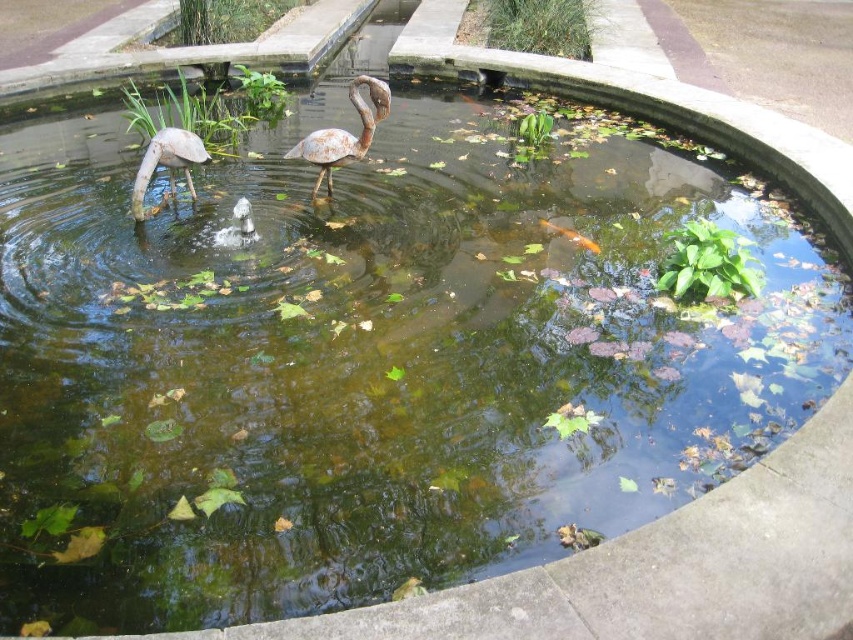
Is point (317, 173) closer to camera compared to point (184, 154)?

No, it is not.

Between rusty metal flamingo at center and matte white flamingo at left, which one is positioned lower?

matte white flamingo at left

Image resolution: width=853 pixels, height=640 pixels. What are the coordinates of `rusty metal flamingo at center` in the screenshot? It's located at 344,132.